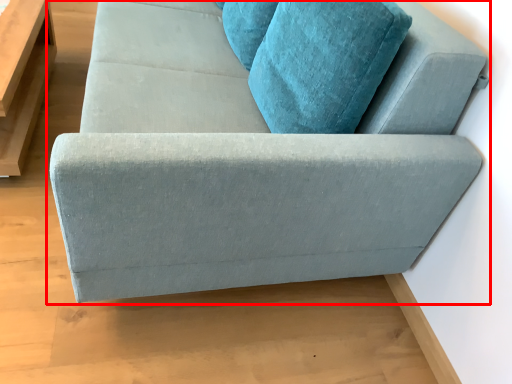
Question: From the image's perspective, what is the correct spatial positioning of studio couch (annotated by the red box) in reference to table?

Choices:
 (A) above
 (B) below

Answer: (A)